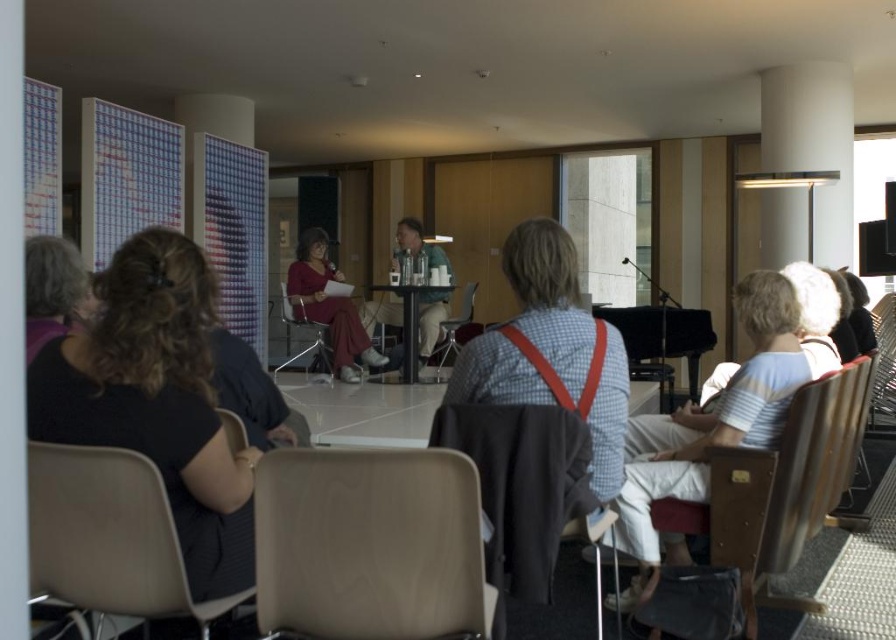
Question: Is beige leather chair at lower left further to the viewer compared to metallic silver chair at center?

Choices:
 (A) no
 (B) yes

Answer: (A)

Question: Which point appears farthest from the camera in this image?

Choices:
 (A) (228, 445)
 (B) (547, 541)

Answer: (B)

Question: Can you confirm if matte red dress at center is bigger than matte black chair at lower left?

Choices:
 (A) yes
 (B) no

Answer: (A)

Question: Which of the following is the closest to the observer?

Choices:
 (A) (71, 460)
 (B) (467, 296)

Answer: (A)

Question: Can you confirm if metallic silver chair at center is bigger than matte plastic chair at center?

Choices:
 (A) no
 (B) yes

Answer: (A)

Question: Estimate the real-world distances between objects in this image. Which object is farther from the light brown leather chair at center?

Choices:
 (A) matte black chair at center
 (B) matte black chair at lower left
 (C) matte red dress at center

Answer: (C)